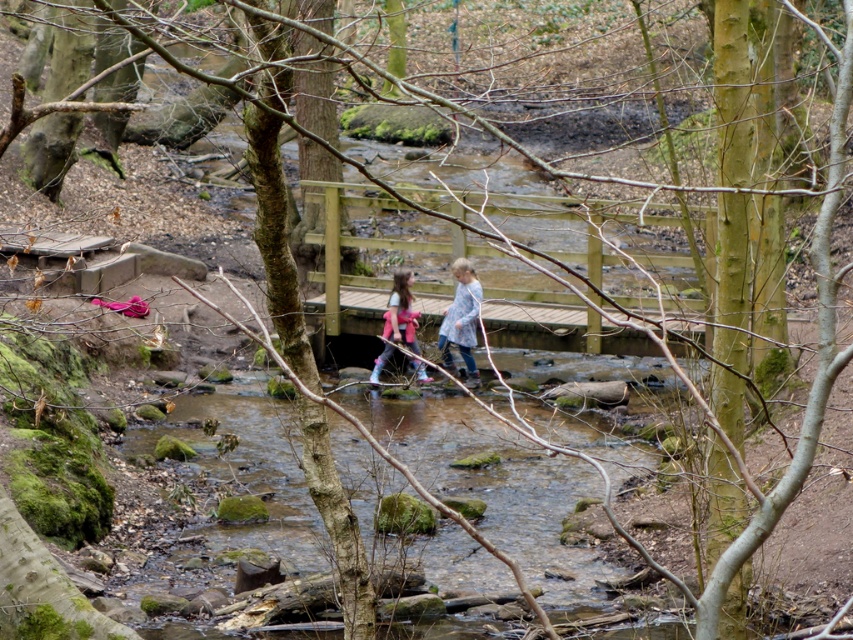
Question: Is wooden bridge at center in front of pink fabric backpack at center?

Choices:
 (A) no
 (B) yes

Answer: (B)

Question: Is wooden bridge at center below plaid fabric shirt at center?

Choices:
 (A) no
 (B) yes

Answer: (A)

Question: Does plaid fabric shirt at center appear on the right side of pink fabric backpack at center?

Choices:
 (A) yes
 (B) no

Answer: (A)

Question: Which point is closer to the camera?

Choices:
 (A) (328, 289)
 (B) (358, 445)
 (C) (453, 326)

Answer: (B)

Question: Which object appears farthest from the camera in this image?

Choices:
 (A) wooden bridge at center
 (B) plaid fabric shirt at center
 (C) pink fabric backpack at center
 (D) clear water at stream center

Answer: (B)

Question: Which of the following is the closest to the observer?

Choices:
 (A) (358, 308)
 (B) (375, 384)
 (C) (474, 340)

Answer: (B)